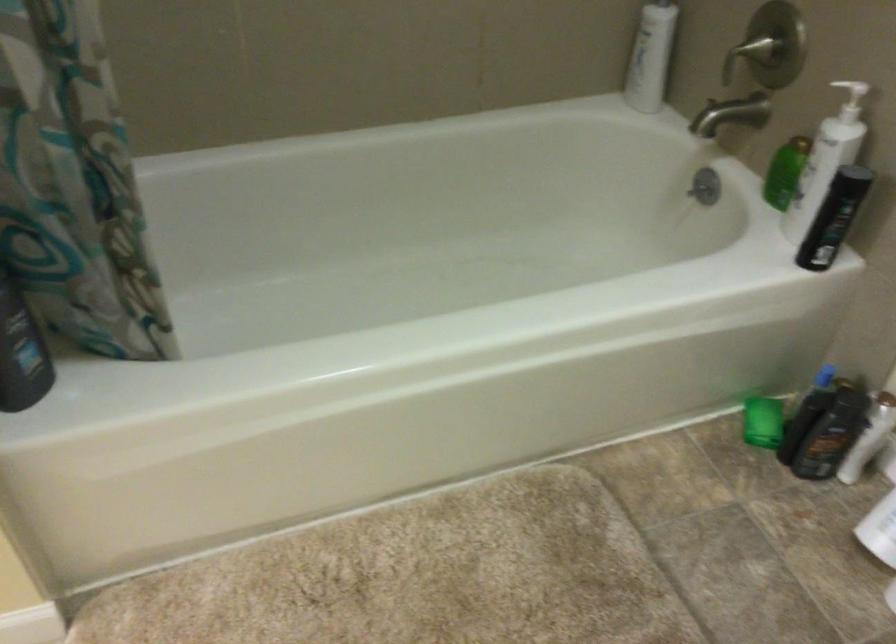
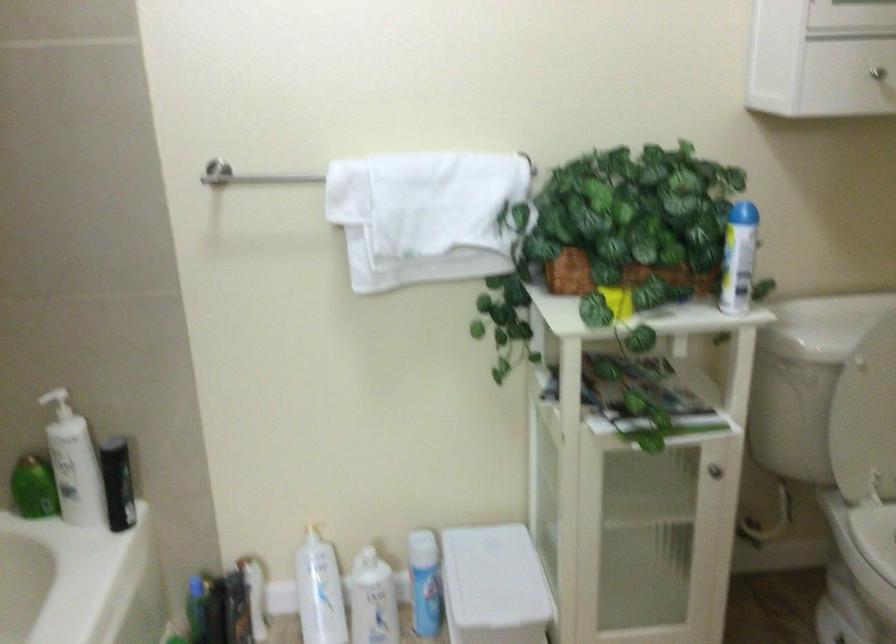
Locate, in the second image, the point that corresponds to point 772,172 in the first image.

(33, 488)